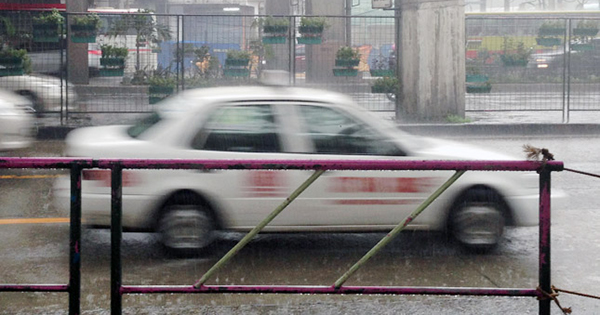
At what (x,y) coordinates should I click in order to perform the action: click on column. Please return your answer as a coordinate pair (x, y). Image resolution: width=600 pixels, height=315 pixels. Looking at the image, I should click on (78, 69), (328, 7), (274, 7), (423, 31).